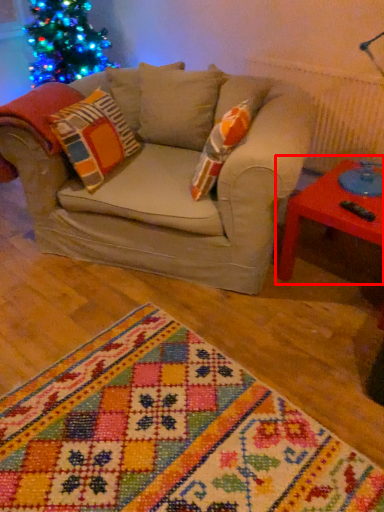
Question: From the image's perspective, what is the correct spatial relationship of table (annotated by the red box) in relation to blanket?

Choices:
 (A) above
 (B) below

Answer: (A)